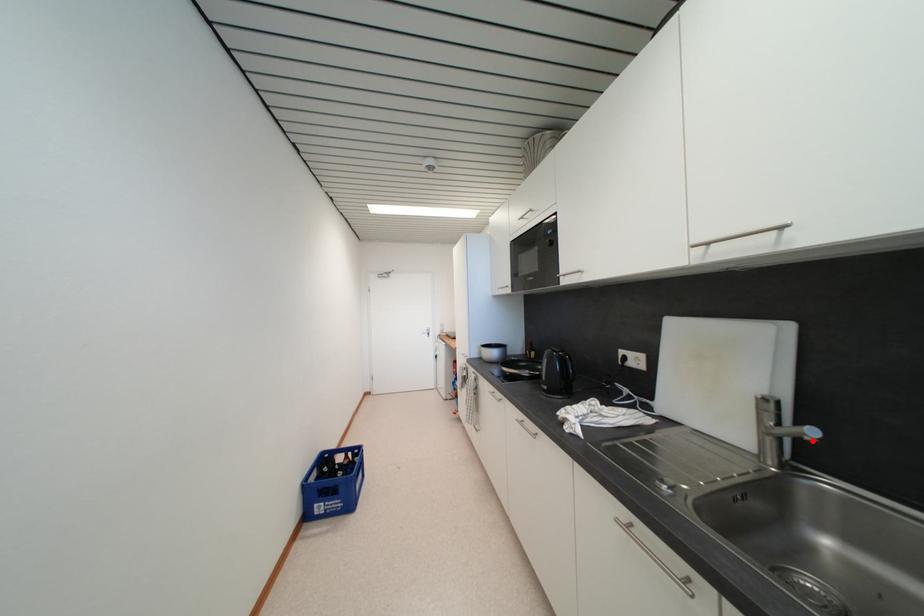
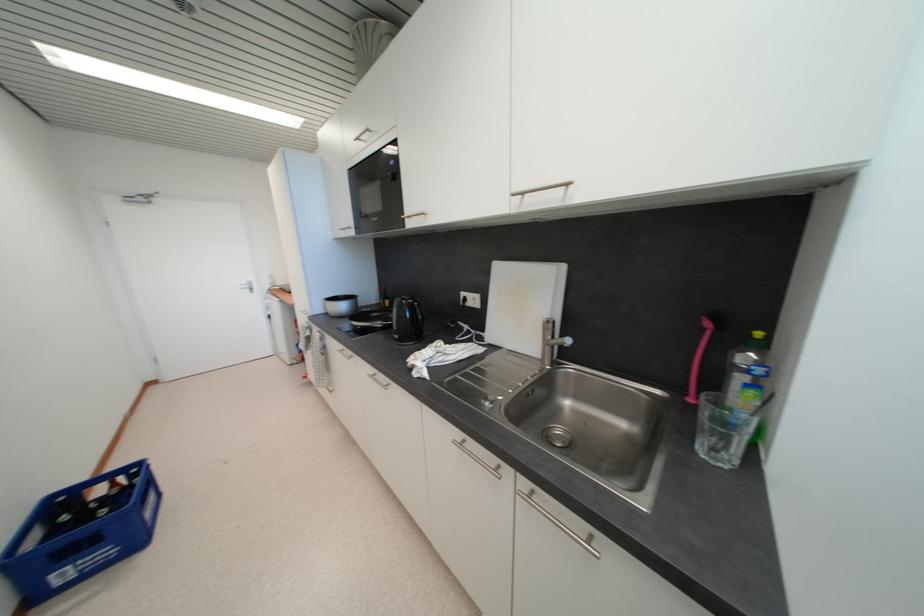
Find the pixel in the second image that matches the highlighted location in the first image.

(570, 347)